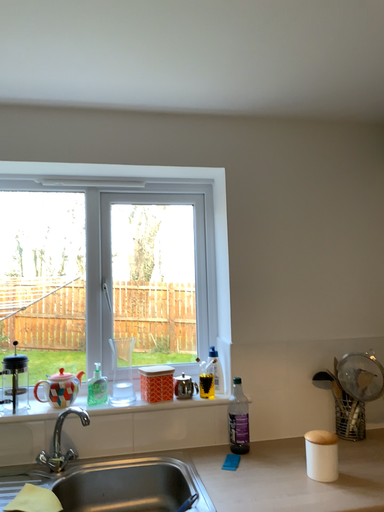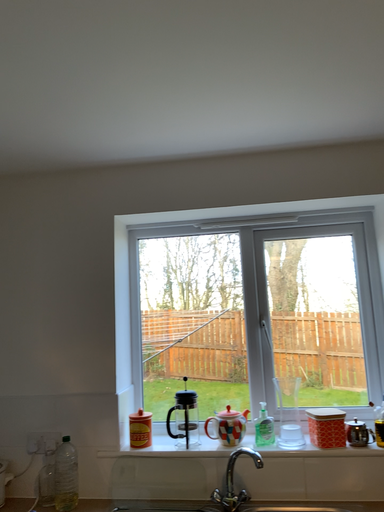
Question: How did the camera likely rotate when shooting the video?

Choices:
 (A) rotated left
 (B) rotated right

Answer: (A)